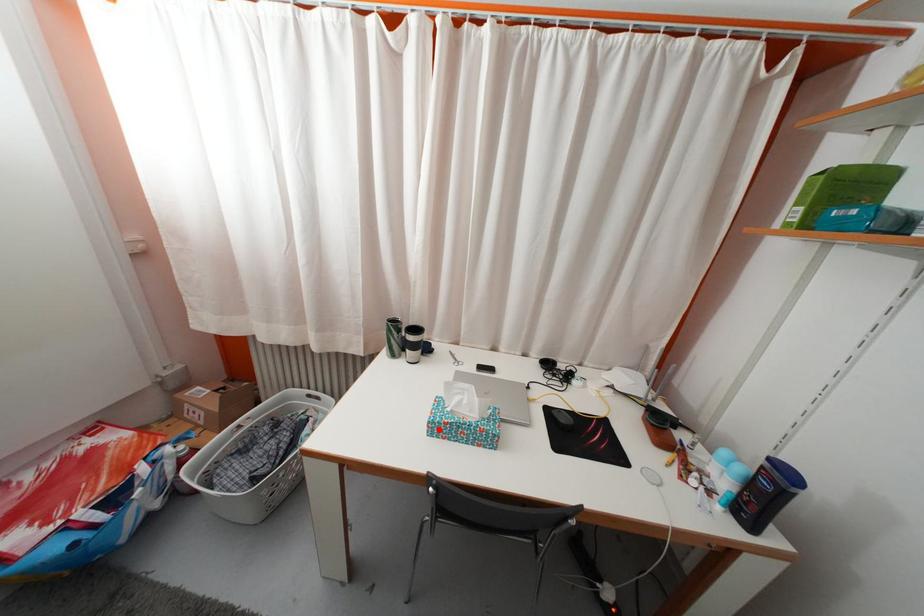
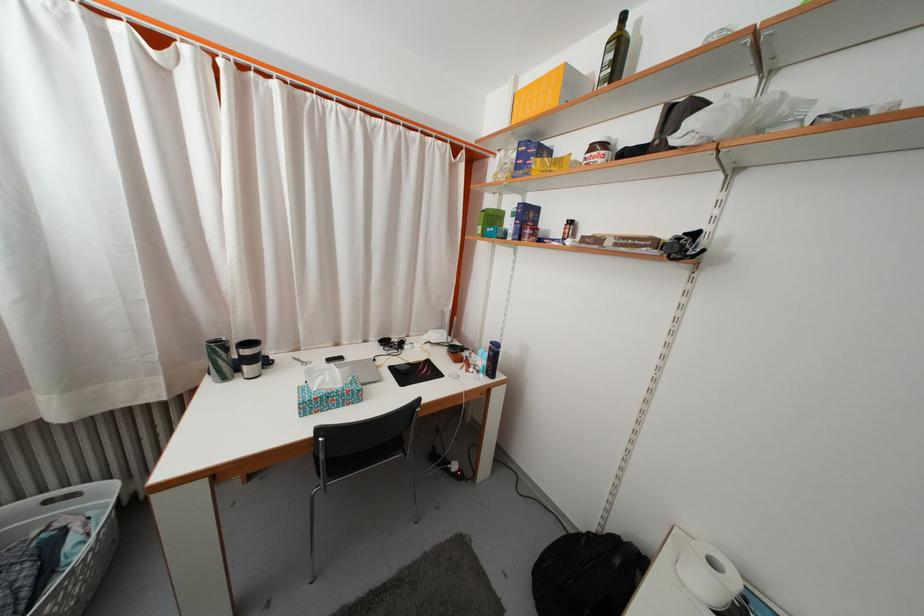
The point at the highlighted location is marked in the first image. Where is the corresponding point in the second image?

(310, 410)